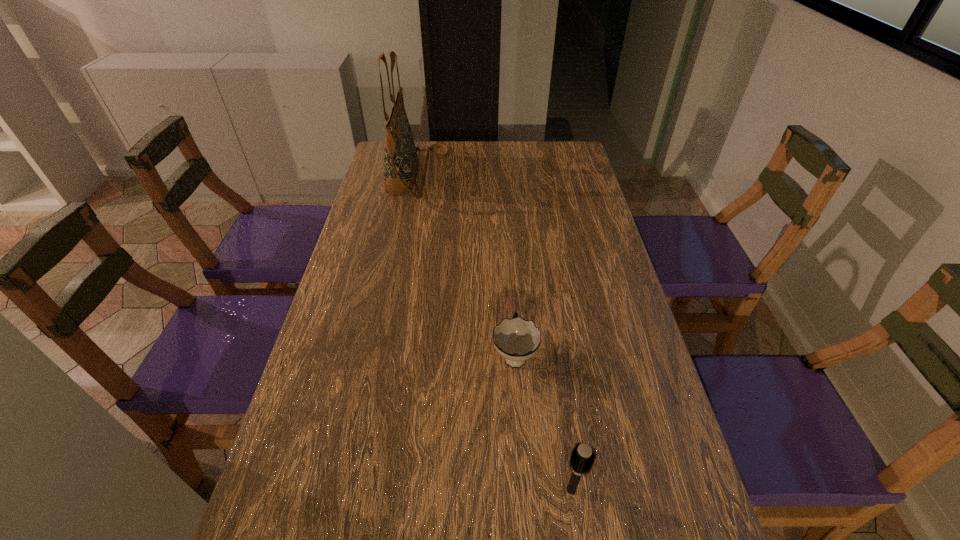
This screenshot has height=540, width=960. In order to click on free area in between the handbag and the second nearest object in this screenshot , I will do `click(466, 264)`.

This screenshot has height=540, width=960. I want to click on unoccupied position between the shortest object and the leftmost object, so click(466, 264).

This screenshot has width=960, height=540. I want to click on vacant space that is in between the tallest object and the second object from right to left, so [x=466, y=264].

Locate an element on the screen. The width and height of the screenshot is (960, 540). vacant space that's between the cup and the hairbrush is located at coordinates (543, 422).

Locate an element on the screen. object that can be found as the second closest to the nearest object is located at coordinates (401, 162).

Choose which object is the nearest neighbor to the handbag. Please provide its 2D coordinates. Your answer should be formatted as a tuple, i.e. [(x, y)], where the tuple contains the x and y coordinates of a point satisfying the conditions above.

[(516, 339)]

The height and width of the screenshot is (540, 960). I want to click on free space that satisfies the following two spatial constraints: 1. on the side of the cup with the handle; 2. on the front-facing side of the tallest object, so click(502, 174).

Find the location of `free point that satisfies the following two spatial constraints: 1. on the front-facing side of the leftmost object; 2. on the left side of the hairbrush`. free point that satisfies the following two spatial constraints: 1. on the front-facing side of the leftmost object; 2. on the left side of the hairbrush is located at coordinates (355, 489).

I want to click on free region that satisfies the following two spatial constraints: 1. on the side of the second farthest object with the handle; 2. on the front-facing side of the leftmost object, so click(x=502, y=174).

Identify the location of free spot that satisfies the following two spatial constraints: 1. on the side of the second object from right to left with the handle; 2. on the front-facing side of the handbag. (502, 174).